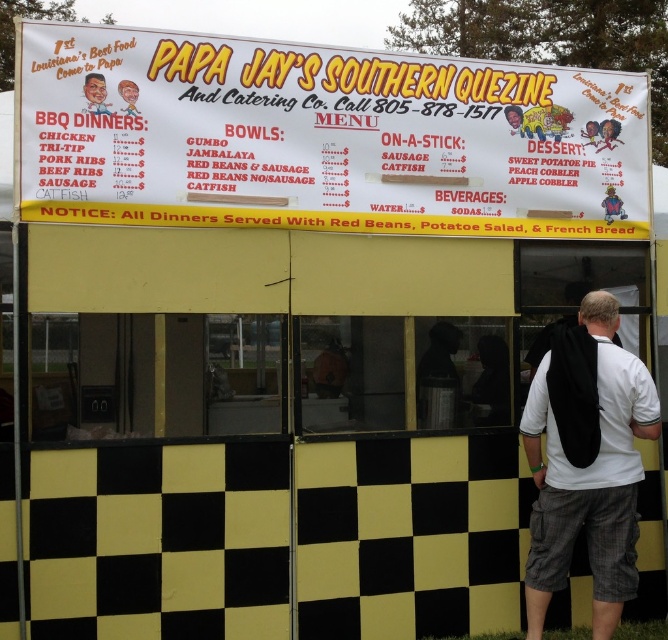
Who is higher up, white fabric backpack at right or smooth plastic head at upper left?

Positioned higher is smooth plastic head at upper left.

Image resolution: width=668 pixels, height=640 pixels. I want to click on white fabric backpack at right, so click(x=587, y=461).

This screenshot has width=668, height=640. What are the coordinates of `white fabric backpack at right` in the screenshot? It's located at (587, 461).

Who is more distant from viewer, (603, 140) or (603, 214)?

Point (603, 140)

Can you confirm if smooth plastic sign at upper center is positioned below smooth plastic cup at upper right?

Result: Actually, smooth plastic sign at upper center is above smooth plastic cup at upper right.

Find the location of a particular element. The height and width of the screenshot is (640, 668). smooth plastic sign at upper center is located at coordinates (609, 132).

Identify the location of smooth plastic sign at upper center. The image size is (668, 640). (609, 132).

Is point (556, 342) positioned behind point (611, 145)?

No, it is not.

Is point (637, 426) in front of point (615, 138)?

Yes, it is.

Image resolution: width=668 pixels, height=640 pixels. I want to click on white fabric backpack at right, so click(x=587, y=461).